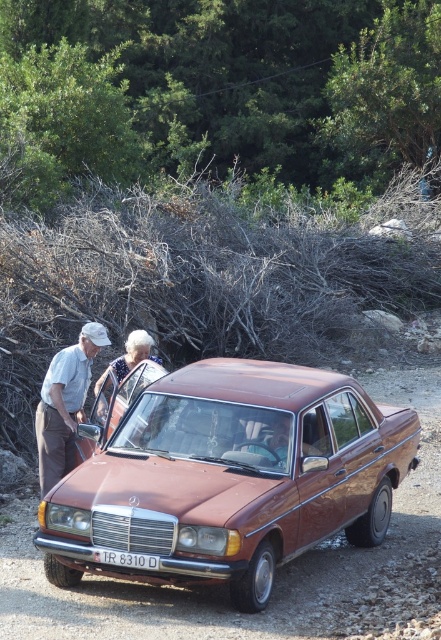
Question: Does light blue cotton shirt at left appear over white plastic license plate at center?

Choices:
 (A) no
 (B) yes

Answer: (B)

Question: Does light blue cotton shirt at left have a greater width compared to white textured dress at center?

Choices:
 (A) no
 (B) yes

Answer: (B)

Question: Which point is farther to the camera?

Choices:
 (A) light blue cotton shirt at left
 (B) white textured dress at center
 (C) rust metallic sedan at center

Answer: (B)

Question: Does light blue cotton shirt at left appear on the right side of white textured dress at center?

Choices:
 (A) no
 (B) yes

Answer: (A)

Question: Which of the following is the farthest from the observer?

Choices:
 (A) (123, 556)
 (B) (153, 355)

Answer: (B)

Question: Among these points, which one is nearest to the camera?

Choices:
 (A) [x=197, y=390]
 (B) [x=108, y=563]

Answer: (B)